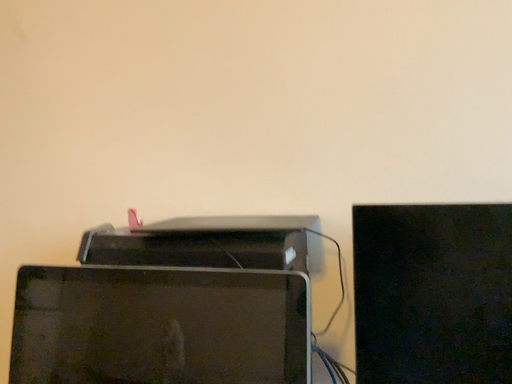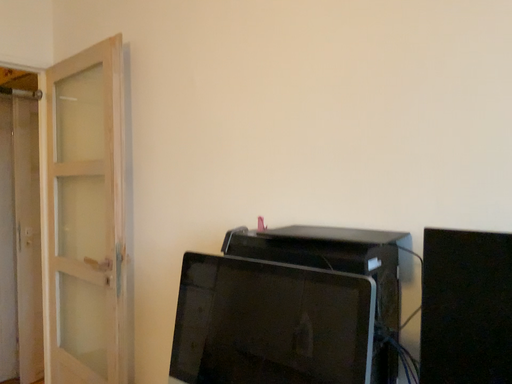
Question: How did the camera likely rotate when shooting the video?

Choices:
 (A) rotated left
 (B) rotated right

Answer: (A)